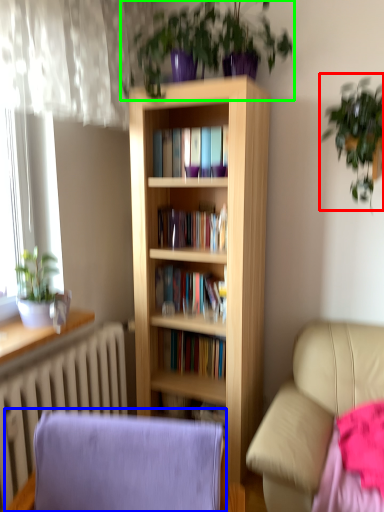
Question: Which object is positioned farthest from houseplant (highlighted by a red box)? Select from rocking chair (highlighted by a blue box) and houseplant (highlighted by a green box).

Choices:
 (A) rocking chair
 (B) houseplant

Answer: (A)